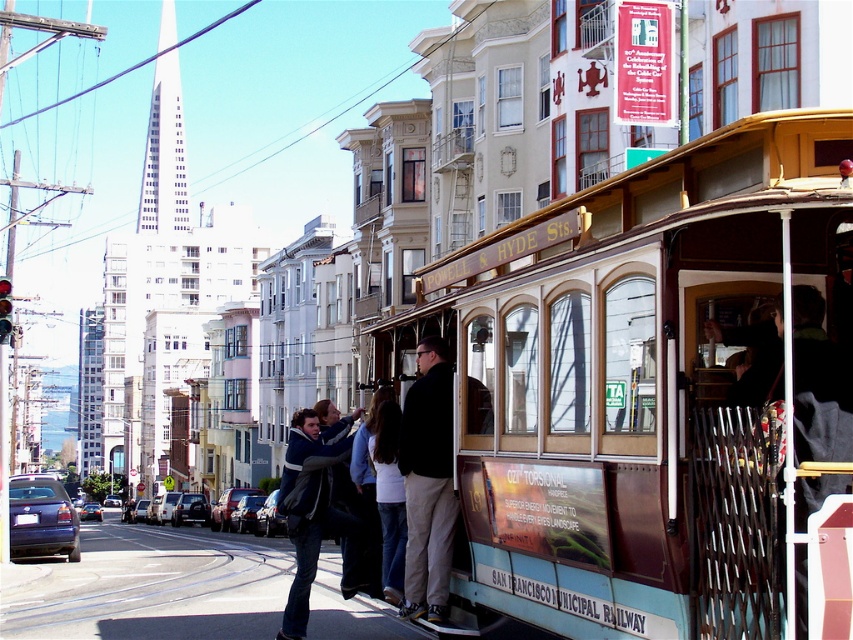
Is point (595, 493) positioned before point (440, 605)?

Yes, point (595, 493) is in front of point (440, 605).

The image size is (853, 640). What do you see at coordinates (616, 362) in the screenshot?
I see `teal polished wood cable car at center` at bounding box center [616, 362].

Between point (759, 307) and point (439, 605), which one is positioned behind?

Point (439, 605)

Identify the location of teal polished wood cable car at center. This screenshot has height=640, width=853. (616, 362).

Does dark brown leather jacket at center have a lesser width compared to denim jacket at lower left?

Yes.

Is point (445, 380) more distant than point (325, 428)?

No.

Find the location of a particular element. dark brown leather jacket at center is located at coordinates (428, 483).

Measure the distance between teal polished wood cable car at center and denim jacket at lower left.

teal polished wood cable car at center is 5.73 meters from denim jacket at lower left.

Who is more forward, (564, 586) or (289, 433)?

Positioned in front is point (564, 586).

The width and height of the screenshot is (853, 640). I want to click on teal polished wood cable car at center, so click(616, 362).